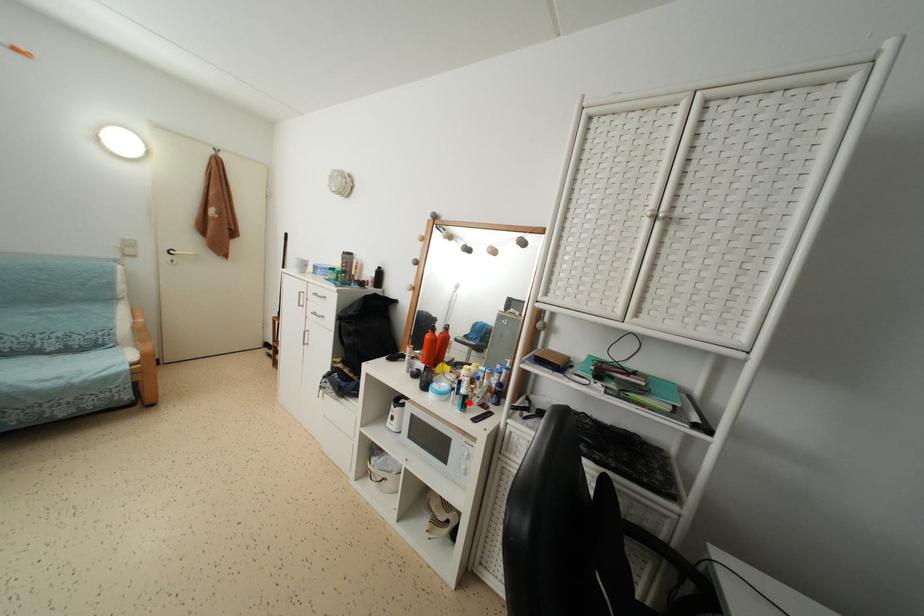
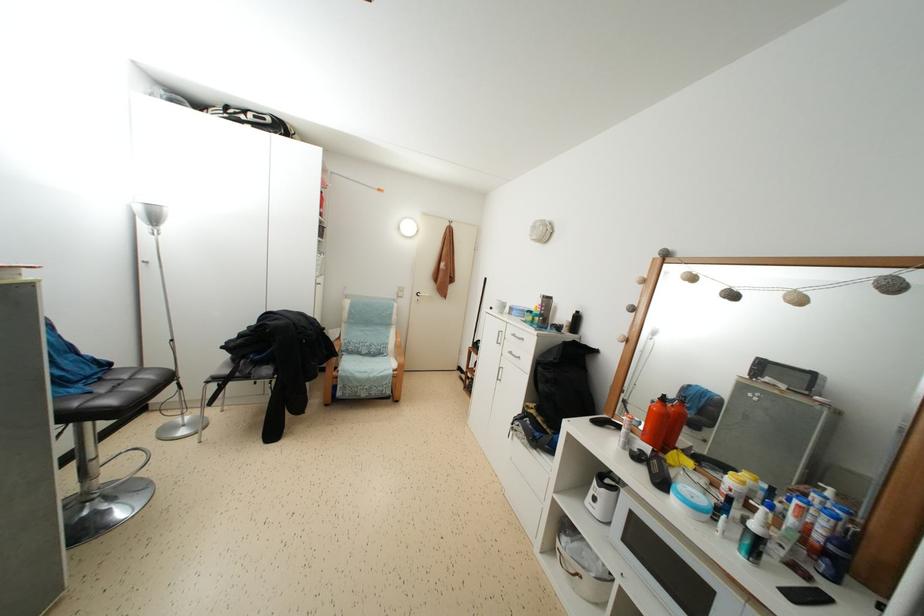
Where in the second image is the point corresponding to the highlighted location from the first image?

(763, 546)